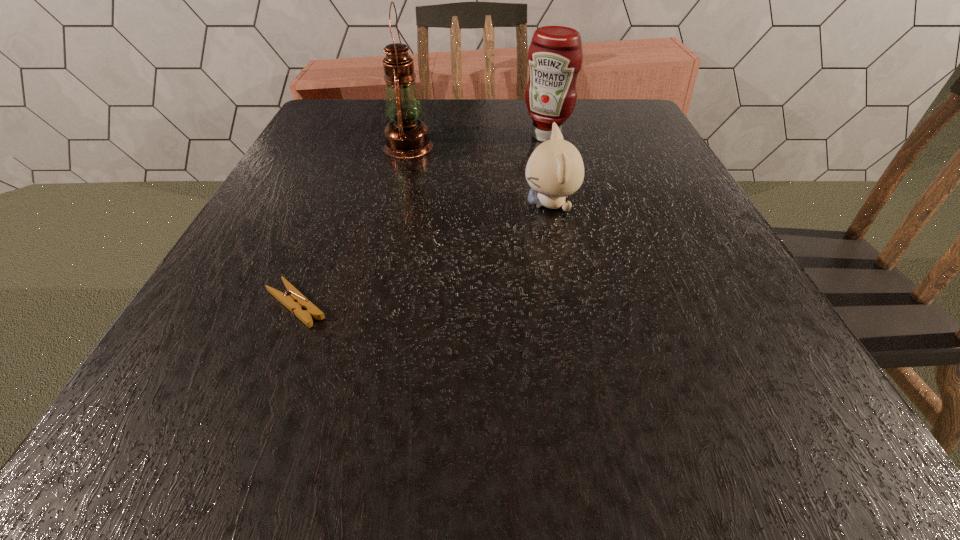
The image size is (960, 540). I want to click on vacant space at the far left corner of the desktop, so click(x=324, y=115).

At what (x,y) coordinates should I click in order to perform the action: click on free space that is in between the shortest object and the second tallest object. Please return your answer as a coordinate pair (x, y). This screenshot has width=960, height=540. Looking at the image, I should click on (421, 220).

Where is `free spot between the condiment and the leftmost object`? The width and height of the screenshot is (960, 540). free spot between the condiment and the leftmost object is located at coordinates (421, 220).

Locate an element on the screen. Image resolution: width=960 pixels, height=540 pixels. free space between the second tallest object and the shortest object is located at coordinates (421, 220).

Locate an element on the screen. blank region between the oil lamp and the condiment is located at coordinates (477, 141).

Find the location of a particular element. Image resolution: width=960 pixels, height=540 pixels. unoccupied position between the third object from right to left and the third farthest object is located at coordinates (479, 176).

Identify the location of vacant space that's between the tallest object and the kitten. (479, 176).

Where is `the third closest object to the condiment`? This screenshot has width=960, height=540. the third closest object to the condiment is located at coordinates (296, 302).

Select which object is the second closest to the oil lamp. Please provide its 2D coordinates. Your answer should be formatted as a tuple, i.e. [(x, y)], where the tuple contains the x and y coordinates of a point satisfying the conditions above.

[(555, 169)]

Where is `free location that satisfies the following two spatial constraints: 1. on the face of the third tallest object; 2. on the front side of the clothespin`? The height and width of the screenshot is (540, 960). free location that satisfies the following two spatial constraints: 1. on the face of the third tallest object; 2. on the front side of the clothespin is located at coordinates (570, 305).